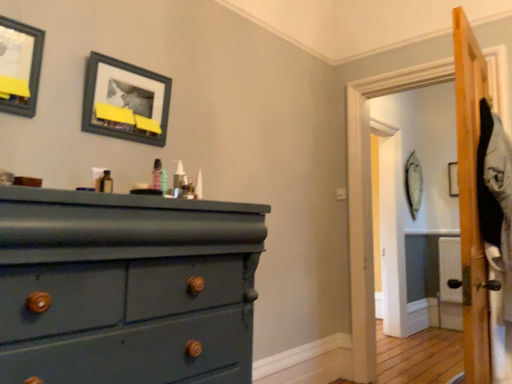
Image resolution: width=512 pixels, height=384 pixels. In order to click on translucent plastic spray bottle at center, which is the 2th toiletry in right-to-left order in this screenshot , I will do `click(179, 176)`.

Locate an element on the screen. This screenshot has height=384, width=512. translucent plastic pump at center, acting as the second toiletry starting from the left is located at coordinates (199, 186).

This screenshot has height=384, width=512. Describe the element at coordinates (125, 101) in the screenshot. I see `matte black picture frame at upper center, the 2th picture frame when ordered from right to left` at that location.

Locate an element on the screen. Image resolution: width=512 pixels, height=384 pixels. matte black picture frame at upper center, acting as the second picture frame starting from the back is located at coordinates (125, 101).

What do you see at coordinates (20, 66) in the screenshot? The width and height of the screenshot is (512, 384). I see `matte black picture frame at upper left, the first picture frame in the front-to-back sequence` at bounding box center [20, 66].

Measure the distance between teal matte wood dresser at left and camera.

teal matte wood dresser at left is 3.33 feet away from camera.

How much space does wooden picture frame at upper right, positioned as the 1th picture frame in back-to-front order, occupy vertically?

The height of wooden picture frame at upper right, positioned as the 1th picture frame in back-to-front order, is 32.19 inches.

This screenshot has height=384, width=512. In order to click on translucent plastic spray bottle at center, which is the 2th toiletry in right-to-left order in this screenshot , I will do `click(179, 176)`.

Consider the image. From a real-world perspective, is matte black picture frame at upper left, the 3th picture frame positioned from the back, positioned above or below teal matte wood dresser at left?

In terms of real-world spatial position, matte black picture frame at upper left, the 3th picture frame positioned from the back, is above teal matte wood dresser at left.

Is matte black picture frame at upper left, the first picture frame in the front-to-back sequence, with teal matte wood dresser at left?

No, matte black picture frame at upper left, the first picture frame in the front-to-back sequence, is not in contact with teal matte wood dresser at left.

Can teal matte wood dresser at left be found inside matte black picture frame at upper left, the first picture frame positioned from the left?

No, teal matte wood dresser at left is not surrounded by matte black picture frame at upper left, the first picture frame positioned from the left.

Which is nearer, (20,91) or (29,376)?

Point (20,91).

In the scene shown: Considering the sizes of wooden picture frame at upper right, positioned as the 1th picture frame in back-to-front order, and translucent plastic pump at center, acting as the first toiletry starting from the right, in the image, is wooden picture frame at upper right, positioned as the 1th picture frame in back-to-front order, taller or shorter than translucent plastic pump at center, acting as the first toiletry starting from the right,?

Considering their sizes, wooden picture frame at upper right, positioned as the 1th picture frame in back-to-front order, has more height than translucent plastic pump at center, acting as the first toiletry starting from the right.

From the image's perspective, starting from the translucent plastic pump at center, acting as the second toiletry starting from the left, which picture frame is the 1st one above? Please provide its 2D coordinates.

[(413, 184)]

Is wooden picture frame at upper right, placed as the third picture frame when sorted from left to right, oriented towards translucent plastic pump at center, acting as the first toiletry starting from the right?

No.

Is wooden picture frame at upper right, placed as the third picture frame when sorted from left to right, far from translucent plastic pump at center, acting as the first toiletry starting from the right?

wooden picture frame at upper right, placed as the third picture frame when sorted from left to right, is positioned a significant distance from translucent plastic pump at center, acting as the first toiletry starting from the right.

Is matte black picture frame at upper center, the 2th picture frame when ordered from right to left, spatially inside matte black picture frame at upper left, the 3th picture frame positioned from the back, or outside of it?

matte black picture frame at upper center, the 2th picture frame when ordered from right to left, cannot be found inside matte black picture frame at upper left, the 3th picture frame positioned from the back.

Based on the photo, is matte black picture frame at upper center, acting as the second picture frame starting from the back, oriented towards matte black picture frame at upper left, the 3th picture frame positioned from the back?

No.

Which of these two, matte black picture frame at upper left, the 3th picture frame positioned from the back, or matte black picture frame at upper center, the second picture frame positioned from the front, stands shorter?

With less height is matte black picture frame at upper center, the second picture frame positioned from the front.

How much distance is there between matte black picture frame at upper left, the first picture frame in the front-to-back sequence, and matte black picture frame at upper center, the second picture frame positioned from the front?

13.87 inches.

Where is `the 1st picture frame to the right when counting from the matte black picture frame at upper left, the 3th picture frame positioned from the back`? the 1st picture frame to the right when counting from the matte black picture frame at upper left, the 3th picture frame positioned from the back is located at coordinates (125, 101).

Can you tell me how much matte black picture frame at upper left, which appears as the third picture frame when viewed from the right, and matte black picture frame at upper center, the second picture frame positioned from the front, differ in facing direction?

They differ by 0.0263 degrees in their facing directions.

Is point (415, 164) less distant than point (182, 164)?

That is False.

Is wooden picture frame at upper right, the first picture frame viewed from the right, wider than translucent plastic spray bottle at center, which appears as the 1th toiletry when viewed from the left?

In fact, wooden picture frame at upper right, the first picture frame viewed from the right, might be narrower than translucent plastic spray bottle at center, which appears as the 1th toiletry when viewed from the left.

Is wooden picture frame at upper right, placed as the third picture frame when sorted from left to right, bigger or smaller than translucent plastic spray bottle at center, which is the 2th toiletry in right-to-left order?

Considering their sizes, wooden picture frame at upper right, placed as the third picture frame when sorted from left to right, takes up more space than translucent plastic spray bottle at center, which is the 2th toiletry in right-to-left order.

Which object is further away from the camera taking this photo, wooden picture frame at upper right, the third picture frame when ordered from front to back, or translucent plastic spray bottle at center, which appears as the 1th toiletry when viewed from the left?

wooden picture frame at upper right, the third picture frame when ordered from front to back, is further from the camera.

Does wooden picture frame at upper right, the first picture frame viewed from the right, have a smaller size compared to matte black picture frame at upper left, the first picture frame positioned from the left?

Incorrect, wooden picture frame at upper right, the first picture frame viewed from the right, is not smaller in size than matte black picture frame at upper left, the first picture frame positioned from the left.

From the picture: From the image's perspective, which one is positioned higher, wooden picture frame at upper right, the third picture frame when ordered from front to back, or matte black picture frame at upper left, which appears as the third picture frame when viewed from the right?

matte black picture frame at upper left, which appears as the third picture frame when viewed from the right.

Between point (411, 210) and point (33, 33), which one is positioned in front?

Point (33, 33)

Is matte black picture frame at upper left, which appears as the third picture frame when viewed from the right, to the left of translucent plastic spray bottle at center, which is the 2th toiletry in right-to-left order, from the viewer's perspective?

Indeed, matte black picture frame at upper left, which appears as the third picture frame when viewed from the right, is positioned on the left side of translucent plastic spray bottle at center, which is the 2th toiletry in right-to-left order.

Looking at their sizes, would you say matte black picture frame at upper left, the first picture frame in the front-to-back sequence, is wider or thinner than translucent plastic spray bottle at center, which is the 2th toiletry in right-to-left order?

In the image, matte black picture frame at upper left, the first picture frame in the front-to-back sequence, appears to be wider than translucent plastic spray bottle at center, which is the 2th toiletry in right-to-left order.

Is matte black picture frame at upper left, the first picture frame in the front-to-back sequence, smaller than translucent plastic spray bottle at center, which is the 2th toiletry in right-to-left order?

No, matte black picture frame at upper left, the first picture frame in the front-to-back sequence, is not smaller than translucent plastic spray bottle at center, which is the 2th toiletry in right-to-left order.

Does matte black picture frame at upper left, the first picture frame positioned from the left, touch translucent plastic spray bottle at center, which appears as the 1th toiletry when viewed from the left?

They are not placed beside each other.

You are a GUI agent. You are given a task and a screenshot of the screen. Output one action in this format:
    pyautogui.click(x=<x>, y=<y>)
    Task: Click on the chest of drawers directly beneath the matte black picture frame at upper left, the first picture frame positioned from the left (from a real-world perspective)
    Image resolution: width=512 pixels, height=384 pixels.
    Given the screenshot: What is the action you would take?
    tap(126, 288)

Identify the location of the 2nd toiletry positioned below the wooden picture frame at upper right, placed as the third picture frame when sorted from left to right (from the image's perspective). (x=199, y=186).

Which object lies nearer to the anchor point translucent plastic pump at center, acting as the first toiletry starting from the right, teal matte wood dresser at left or matte black picture frame at upper center, the second picture frame positioned from the front?

matte black picture frame at upper center, the second picture frame positioned from the front, is closer to translucent plastic pump at center, acting as the first toiletry starting from the right.

Considering their positions, is matte black picture frame at upper left, the first picture frame positioned from the left, positioned further to translucent plastic pump at center, acting as the second toiletry starting from the left, than translucent plastic spray bottle at center, which is the 2th toiletry in right-to-left order?

The object further to translucent plastic pump at center, acting as the second toiletry starting from the left, is matte black picture frame at upper left, the first picture frame positioned from the left.

Considering their positions, is matte black picture frame at upper left, the 3th picture frame positioned from the back, positioned closer to wooden picture frame at upper right, placed as the third picture frame when sorted from left to right, than matte black picture frame at upper center, the second picture frame positioned from the front?

matte black picture frame at upper center, the second picture frame positioned from the front.

In the scene shown: When comparing their distances from matte black picture frame at upper center, which ranks as the 2th picture frame in left-to-right order, does translucent plastic pump at center, acting as the first toiletry starting from the right, or matte black picture frame at upper left, the first picture frame positioned from the left, seem further?

translucent plastic pump at center, acting as the first toiletry starting from the right, lies further to matte black picture frame at upper center, which ranks as the 2th picture frame in left-to-right order, than the other object.

From the image, which object appears to be nearer to matte black picture frame at upper center, acting as the second picture frame starting from the back, translucent plastic spray bottle at center, which is the 2th toiletry in right-to-left order, or matte black picture frame at upper left, the first picture frame positioned from the left?

matte black picture frame at upper left, the first picture frame positioned from the left.

Looking at the image, which one is located further to translucent plastic pump at center, acting as the first toiletry starting from the right, matte black picture frame at upper left, which appears as the third picture frame when viewed from the right, or matte black picture frame at upper center, the second picture frame positioned from the front?

Among the two, matte black picture frame at upper left, which appears as the third picture frame when viewed from the right, is located further to translucent plastic pump at center, acting as the first toiletry starting from the right.

Considering their positions, is teal matte wood dresser at left positioned further to translucent plastic spray bottle at center, which appears as the 1th toiletry when viewed from the left, than translucent plastic pump at center, acting as the first toiletry starting from the right?

The object further to translucent plastic spray bottle at center, which appears as the 1th toiletry when viewed from the left, is teal matte wood dresser at left.

Estimate the real-world distances between objects in this image. Which object is further from wooden picture frame at upper right, positioned as the 1th picture frame in back-to-front order, matte black picture frame at upper left, the first picture frame positioned from the left, or translucent plastic pump at center, acting as the second toiletry starting from the left?

The object further to wooden picture frame at upper right, positioned as the 1th picture frame in back-to-front order, is matte black picture frame at upper left, the first picture frame positioned from the left.

At what (x,y) coordinates should I click in order to perform the action: click on picture frame between matte black picture frame at upper left, which appears as the third picture frame when viewed from the right, and translucent plastic spray bottle at center, which appears as the 1th toiletry when viewed from the left. Please return your answer as a coordinate pair (x, y). Looking at the image, I should click on (125, 101).

Locate an element on the screen. toiletry between translucent plastic spray bottle at center, which appears as the 1th toiletry when viewed from the left, and wooden picture frame at upper right, the third picture frame when ordered from front to back, in the front-back direction is located at coordinates click(199, 186).

Locate an element on the screen. This screenshot has height=384, width=512. picture frame between matte black picture frame at upper left, which appears as the third picture frame when viewed from the right, and wooden picture frame at upper right, placed as the third picture frame when sorted from left to right, along the z-axis is located at coordinates [x=125, y=101].

This screenshot has width=512, height=384. In order to click on picture frame positioned between translucent plastic spray bottle at center, which appears as the 1th toiletry when viewed from the left, and wooden picture frame at upper right, placed as the third picture frame when sorted from left to right, from near to far in this screenshot , I will do `click(125, 101)`.